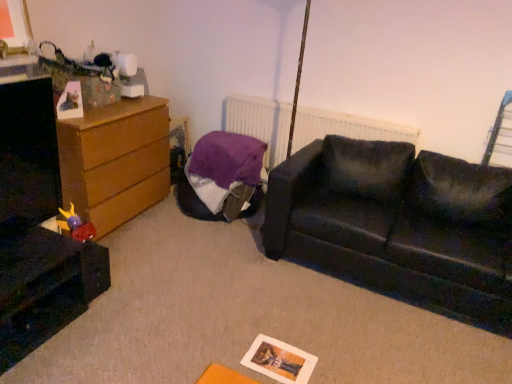
What do you see at coordinates (76, 225) in the screenshot? Image resolution: width=512 pixels, height=384 pixels. I see `plush purple toy at lower left` at bounding box center [76, 225].

The width and height of the screenshot is (512, 384). What do you see at coordinates (223, 177) in the screenshot? I see `purple fabric bean bag at center` at bounding box center [223, 177].

Find the location of a particular element. This screenshot has height=384, width=512. black glossy file cabinet at lower left is located at coordinates (44, 287).

Identify the location of black leather couch at center. This screenshot has width=512, height=384. (398, 223).

Is black glossy file cabinet at lower left surrounded by purple fabric bean bag at center?

No.

Where is `bean bag chair behind the black glossy file cabinet at lower left`? bean bag chair behind the black glossy file cabinet at lower left is located at coordinates (223, 177).

Is purple fabric bean bag at center looking in the opposite direction of black glossy file cabinet at lower left?

purple fabric bean bag at center is not turned away from black glossy file cabinet at lower left.

Can you tell me how much white matte radiator at upper center and plush purple toy at lower left differ in facing direction?

93 degrees separate the facing orientations of white matte radiator at upper center and plush purple toy at lower left.

From the image's perspective, which object appears higher, white matte radiator at upper center or plush purple toy at lower left?

white matte radiator at upper center.

Between white matte radiator at upper center and plush purple toy at lower left, which one appears on the right side from the viewer's perspective?

From the viewer's perspective, white matte radiator at upper center appears more on the right side.

Is plush purple toy at lower left looking in the opposite direction of purple fabric bean bag at center?

No, purple fabric bean bag at center is not at the back of plush purple toy at lower left.

From the image's perspective, is plush purple toy at lower left positioned above or below purple fabric bean bag at center?

plush purple toy at lower left is situated lower than purple fabric bean bag at center in the image.

Does plush purple toy at lower left come in front of purple fabric bean bag at center?

That is True.

Which is further, (71, 231) or (228, 178)?

The point (228, 178) is farther from the camera.

Is point (509, 118) farther from camera compared to point (10, 270)?

Yes, it is behind point (10, 270).

Is metallic silver swivel chair at upper right in front of or behind black glossy file cabinet at lower left in the image?

Visually, metallic silver swivel chair at upper right is located behind black glossy file cabinet at lower left.

Considering the relative sizes of metallic silver swivel chair at upper right and black glossy file cabinet at lower left in the image provided, is metallic silver swivel chair at upper right shorter than black glossy file cabinet at lower left?

No.

Considering the relative sizes of metallic silver swivel chair at upper right and black glossy file cabinet at lower left in the image provided, is metallic silver swivel chair at upper right smaller than black glossy file cabinet at lower left?

Indeed, metallic silver swivel chair at upper right has a smaller size compared to black glossy file cabinet at lower left.

Considering the sizes of objects purple fabric bean bag at center and wooden chest of drawers at left in the image provided, who is smaller, purple fabric bean bag at center or wooden chest of drawers at left?

purple fabric bean bag at center.

Is purple fabric bean bag at center placed right next to wooden chest of drawers at left?

No, purple fabric bean bag at center is not in contact with wooden chest of drawers at left.

Can you tell me how much purple fabric bean bag at center and wooden chest of drawers at left differ in facing direction?

93 degrees separate the facing orientations of purple fabric bean bag at center and wooden chest of drawers at left.

Is black leather couch at center directly adjacent to plush purple toy at lower left?

They are not placed beside each other.

From the picture: How distant is black leather couch at center from plush purple toy at lower left?

The distance of black leather couch at center from plush purple toy at lower left is 1.55 meters.

Between black leather couch at center and plush purple toy at lower left, which one appears on the left side from the viewer's perspective?

From the viewer's perspective, plush purple toy at lower left appears more on the left side.

Can plush purple toy at lower left be found inside black leather couch at center?

No, plush purple toy at lower left is not inside black leather couch at center.

How different are the orientations of black glossy file cabinet at lower left and black leather couch at center in degrees?

There is a 90.6-degree angle between the facing directions of black glossy file cabinet at lower left and black leather couch at center.

Find the location of `studio couch that appears on the right of black glossy file cabinet at lower left`. studio couch that appears on the right of black glossy file cabinet at lower left is located at coordinates (398, 223).

From the image's perspective, who appears lower, black glossy file cabinet at lower left or black leather couch at center?

black glossy file cabinet at lower left.

Locate an element on the screen. file cabinet on the left of purple fabric bean bag at center is located at coordinates (44, 287).

Where is `toy below the white matte radiator at upper center (from a real-world perspective)`? This screenshot has height=384, width=512. toy below the white matte radiator at upper center (from a real-world perspective) is located at coordinates (76, 225).

From the picture: From the image, which object appears to be nearer to wooden chest of drawers at left, black leather couch at center or plush purple toy at lower left?

Based on the image, plush purple toy at lower left appears to be nearer to wooden chest of drawers at left.

Estimate the real-world distances between objects in this image. Which object is further from black leather couch at center, black glossy file cabinet at lower left or plush purple toy at lower left?

plush purple toy at lower left is positioned further to the anchor black leather couch at center.

When comparing their distances from wooden chest of drawers at left, does black leather couch at center or black glossy file cabinet at lower left seem closer?

black glossy file cabinet at lower left lies closer to wooden chest of drawers at left than the other object.

Consider the image. Considering their positions, is wooden chest of drawers at left positioned closer to white matte radiator at upper center than black leather couch at center?

Based on the image, black leather couch at center appears to be nearer to white matte radiator at upper center.

Considering their positions, is purple fabric bean bag at center positioned further to black glossy file cabinet at lower left than black leather couch at center?

black leather couch at center lies further to black glossy file cabinet at lower left than the other object.

Which object lies further to the anchor point wooden chest of drawers at left, black glossy file cabinet at lower left or metallic silver swivel chair at upper right?

metallic silver swivel chair at upper right is further to wooden chest of drawers at left.

Looking at the image, which one is located closer to black glossy file cabinet at lower left, plush purple toy at lower left or white matte radiator at upper center?

Based on the image, plush purple toy at lower left appears to be nearer to black glossy file cabinet at lower left.

Which object lies further to the anchor point wooden chest of drawers at left, black glossy file cabinet at lower left or black leather couch at center?

black leather couch at center lies further to wooden chest of drawers at left than the other object.

You are a GUI agent. You are given a task and a screenshot of the screen. Output one action in this format:
    pyautogui.click(x=<x>, y=<y>)
    Task: Click on the bean bag chair between plush purple toy at lower left and black leather couch at center in the horizontal direction
    The width and height of the screenshot is (512, 384).
    Given the screenshot: What is the action you would take?
    click(x=223, y=177)

Where is `toy located between wooden chest of drawers at left and metallic silver swivel chair at upper right in the left-right direction`? This screenshot has width=512, height=384. toy located between wooden chest of drawers at left and metallic silver swivel chair at upper right in the left-right direction is located at coordinates (76, 225).

Image resolution: width=512 pixels, height=384 pixels. What are the coordinates of `radiator between wooden chest of drawers at left and black leather couch at center from left to right` in the screenshot? It's located at (260, 123).

Identify the location of studio couch between purple fabric bean bag at center and metallic silver swivel chair at upper right from left to right. Image resolution: width=512 pixels, height=384 pixels. (398, 223).